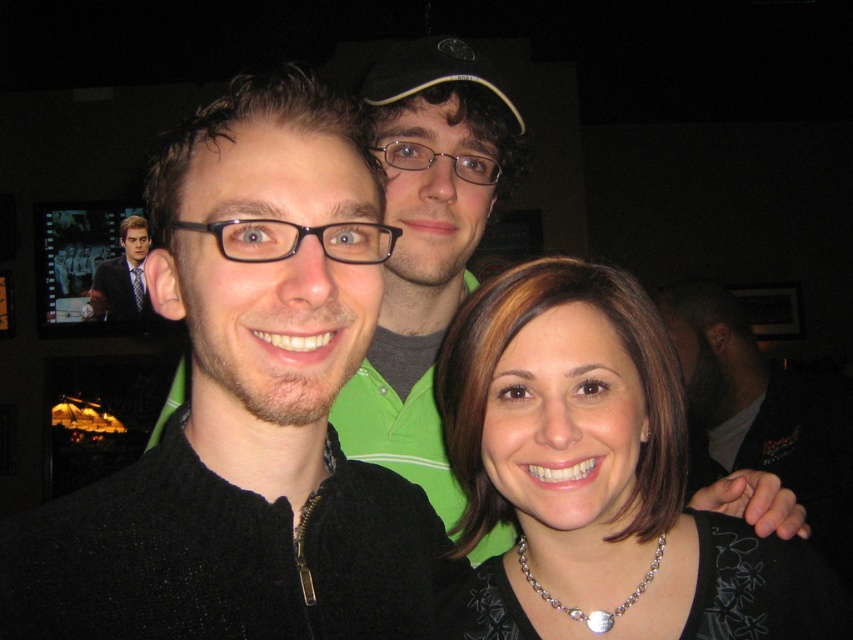
You are a photographer adjusting lighting for a closeup shot of the matte black necklace at center and the matte black suit at upper left. Since the necklace is smaller, will it require a different lighting setup compared to the suit?

The matte black necklace at center is narrower than the matte black suit at upper left, so it might need a different lighting setup to ensure proper exposure and detail capture.

You are standing at point (96, 316) and want to move to point (473, 468). Is the path directly between these two points clear of any obstacles?

Yes, the path between point (473, 468) and point (96, 316) is clear because point (473, 468) is in front of point (96, 316), indicating no obstruction between them.